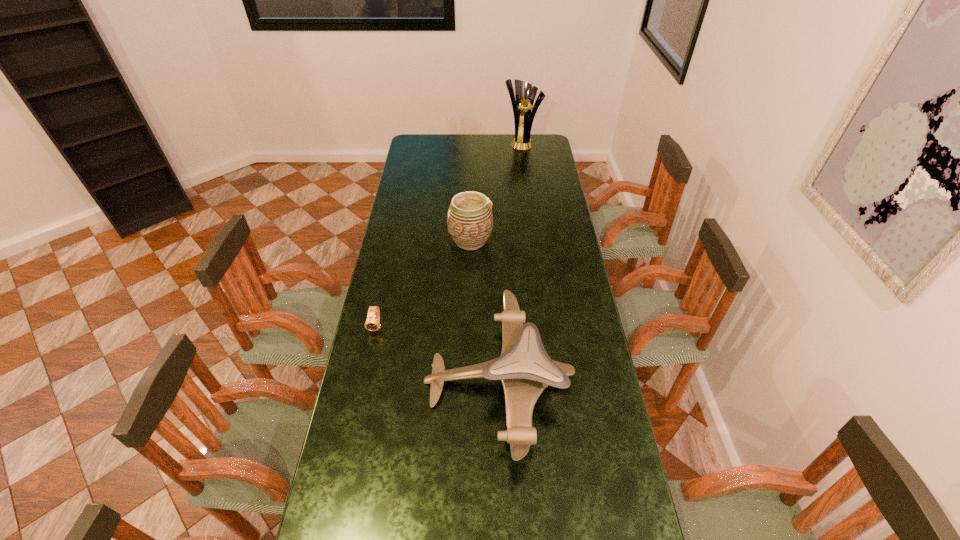
You are a GUI agent. You are given a task and a screenshot of the screen. Output one action in this format:
    pyautogui.click(x=<x>, y=<y>)
    Task: Click on the free space located on the front-facing side of the second shortest object
    
    Given the screenshot: What is the action you would take?
    pyautogui.click(x=398, y=381)

Image resolution: width=960 pixels, height=540 pixels. I want to click on vacant space located on the face of the shortest object, so [x=363, y=388].

The width and height of the screenshot is (960, 540). Find the location of `object positioned at the far edge`. object positioned at the far edge is located at coordinates (525, 93).

I want to click on object situated at the left edge, so click(372, 323).

Locate an element on the screen. Image resolution: width=960 pixels, height=540 pixels. award present at the right edge is located at coordinates (525, 93).

The height and width of the screenshot is (540, 960). Identify the location of drone positioned at the right edge. (525, 369).

Image resolution: width=960 pixels, height=540 pixels. Identify the location of object that is positioned at the far right corner. (525, 93).

You are a GUI agent. You are given a task and a screenshot of the screen. Output one action in this format:
    pyautogui.click(x=<x>, y=<y>)
    Task: Click on the vacant space at the left edge of the desktop
    This screenshot has height=540, width=960.
    Given the screenshot: What is the action you would take?
    pos(374,360)

The height and width of the screenshot is (540, 960). What are the coordinates of `free space at the right edge of the desktop` in the screenshot? It's located at (595, 492).

Where is `free region at the far left corner of the desktop`? The height and width of the screenshot is (540, 960). free region at the far left corner of the desktop is located at coordinates (427, 142).